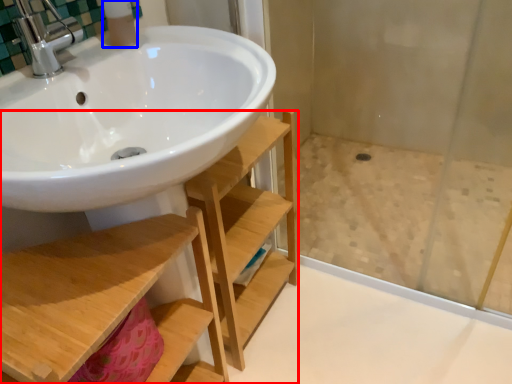
Question: Which object appears farthest to the camera in this image, shelf (highlighted by a red box) or toiletry (highlighted by a blue box)?

Choices:
 (A) shelf
 (B) toiletry

Answer: (B)